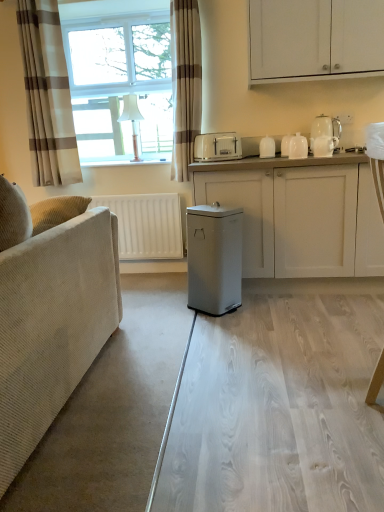
You are a GUI agent. You are given a task and a screenshot of the screen. Output one action in this format:
    pyautogui.click(x=<x>, y=<y>)
    Task: Click on the unoccupied region to the right of metallic gray trash can at center
    Image resolution: width=384 pixels, height=512 pixels.
    Given the screenshot: What is the action you would take?
    pyautogui.click(x=263, y=310)